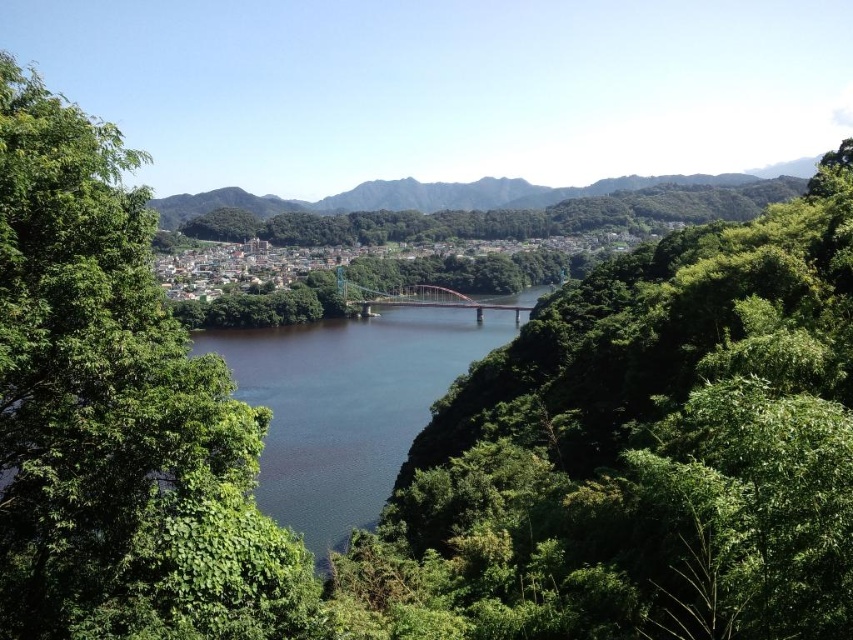
You are an artist sketching the landscape and want to place the green leafy tree at center in your drawing. According to the scene, where should you position it on your grid paper using coordinates?

The green leafy tree at center should be positioned at coordinates approximately 0.709 on the x axis and 0.754 on the y axis.

Consider the image. You are standing at the center of the image and want to walk towards the green leafy tree at center. Which direction should you move to reach it?

The green leafy tree at center is already at the center of the image, so you are already facing it. No need to move in any direction.

You are standing in the serene landscape scene and want to take a photo of the green leafy tree at center. If your camera has a maximum focus range of 50 meters, will it be able to capture the tree clearly?

The green leafy tree at center is 53.10 meters away from the viewer. Since the camera can only focus up to 50 meters, it won cannot capture the tree clearly within the maximum focus range.